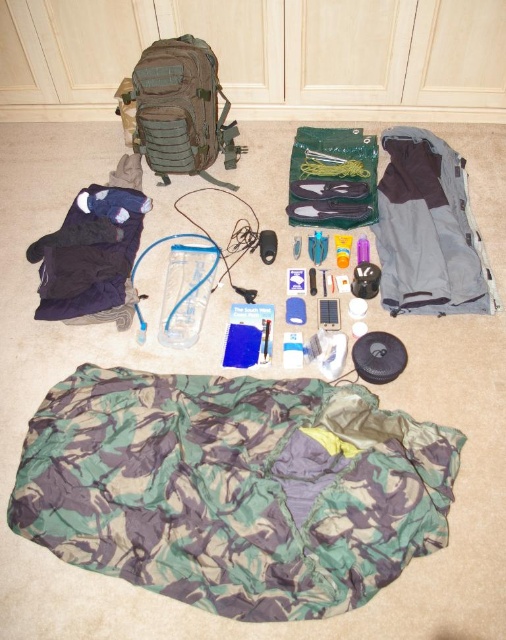
Question: Is gray fabric at upper right wider than navy blue fleece at lower left?

Choices:
 (A) yes
 (B) no

Answer: (B)

Question: Which point is farther to the camera?

Choices:
 (A) (234, 188)
 (B) (72, 404)

Answer: (A)

Question: Can you confirm if camouflage fabric sleeping bag at lower center is smaller than gray fabric at upper right?

Choices:
 (A) no
 (B) yes

Answer: (A)

Question: Which of the following is the closest to the observer?

Choices:
 (A) gray fabric at upper right
 (B) camouflage fabric backpack at upper left

Answer: (A)

Question: Considering the relative positions of camouflage fabric sleeping bag at lower center and gray fabric at upper right in the image provided, where is camouflage fabric sleeping bag at lower center located with respect to gray fabric at upper right?

Choices:
 (A) below
 (B) above

Answer: (A)

Question: Which object appears closest to the camera in this image?

Choices:
 (A) camouflage fabric backpack at upper left
 (B) camouflage fabric sleeping bag at lower center
 (C) gray fabric at upper right
 (D) navy blue fleece at lower left

Answer: (B)